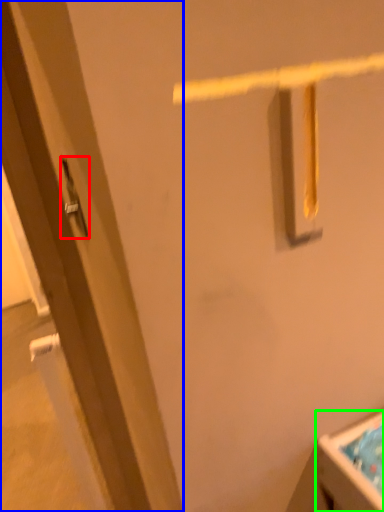
Question: Estimate the real-world distances between objects in this image. Which object is closer to door handle (highlighted by a red box), door (highlighted by a blue box) or sink (highlighted by a green box)?

Choices:
 (A) door
 (B) sink

Answer: (A)